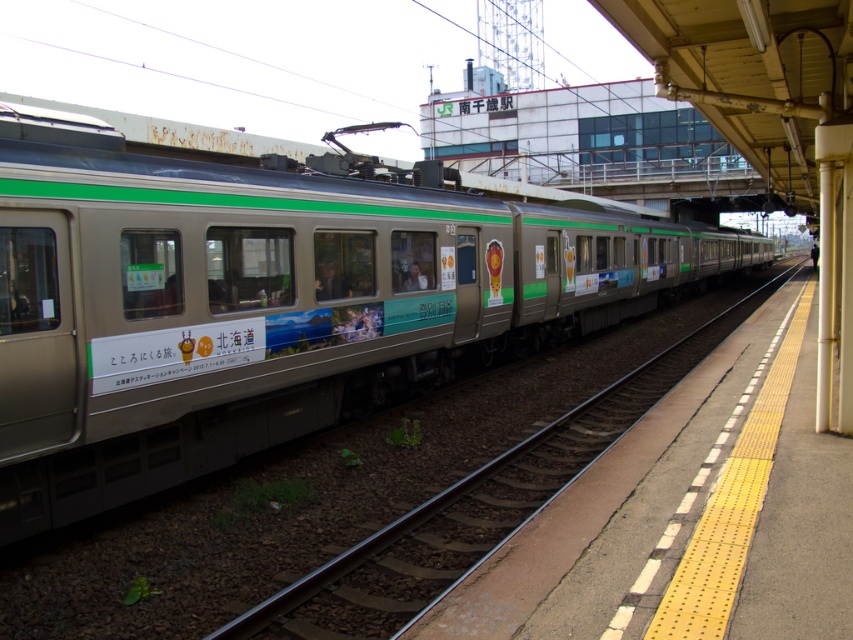
Which is behind, point (656, 211) or point (339, 577)?

Point (656, 211)

Can you confirm if metallic silver train at center is thinner than metallic train track at center?

No, metallic silver train at center is not thinner than metallic train track at center.

At what (x,y) coordinates should I click in order to perform the action: click on metallic silver train at center. Please return your answer as a coordinate pair (x, y). This screenshot has width=853, height=640. Looking at the image, I should click on (270, 300).